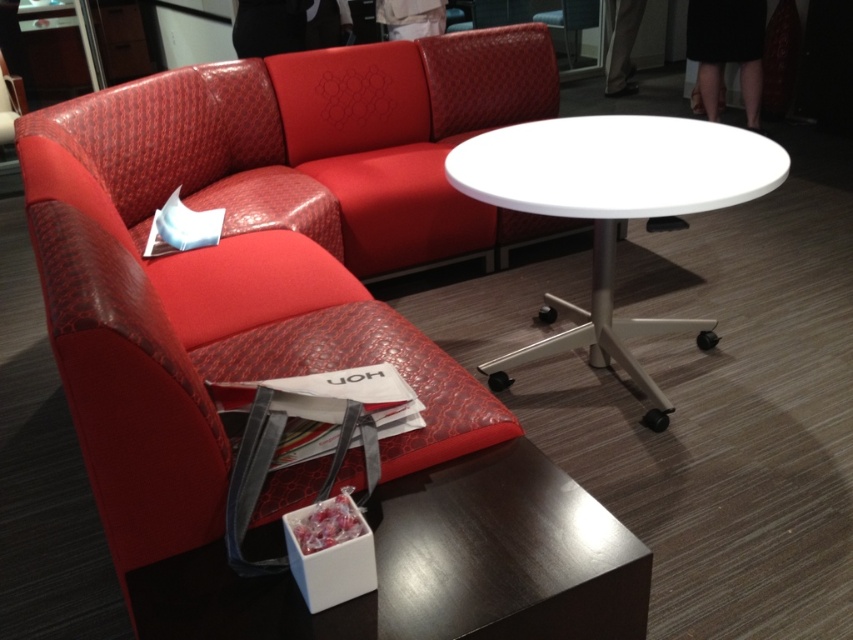
Can you confirm if leather-like red couch at upper left is bigger than white glossy table at center?

Yes.

Is point (306, 240) positioned behind point (595, 204)?

Yes.

Image resolution: width=853 pixels, height=640 pixels. I want to click on leather-like red couch at upper left, so tap(260, 252).

Can you confirm if shiny dark wood side table at lower center is positioned below white glossy table at center?

Yes.

Does shiny dark wood side table at lower center have a lesser width compared to white glossy table at center?

Yes.

Locate an element on the screen. shiny dark wood side table at lower center is located at coordinates (434, 566).

The image size is (853, 640). Find the location of `shiny dark wood side table at lower center`. shiny dark wood side table at lower center is located at coordinates (434, 566).

Is point (163, 499) in front of point (457, 528)?

Yes, it is in front of point (457, 528).

Between point (438, 148) and point (299, 600), which one is positioned in front?

Point (299, 600) is in front.

Is point (560, 227) positioned before point (506, 525)?

No, (560, 227) is further to viewer.

Find the location of a particular element. The width and height of the screenshot is (853, 640). leather-like red couch at upper left is located at coordinates (260, 252).